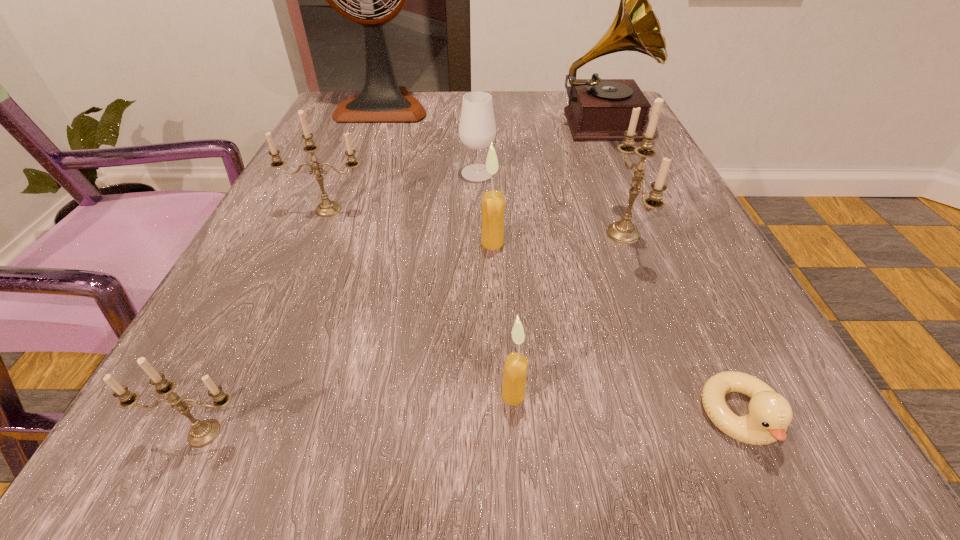
Identify the location of free space between the phonograph record and the nearer cream candle. Image resolution: width=960 pixels, height=540 pixels. (557, 260).

I want to click on object that ranks as the second closest to the shortest object, so click(x=515, y=367).

Identify the location of object that can be found as the fifth closest to the bigger cream candle. This screenshot has height=540, width=960. (599, 109).

Where is `candle that is the second closest to the nearest candle`? This screenshot has height=540, width=960. candle that is the second closest to the nearest candle is located at coordinates (327, 208).

Locate which candle is the second closest to the nearest metallic candle. Please provide its 2D coordinates. Your answer should be formatted as a tuple, i.e. [(x, y)], where the tuple contains the x and y coordinates of a point satisfying the conditions above.

[(327, 208)]

Where is `metallic candle that can be found as the second closest to the nearest candle`? The height and width of the screenshot is (540, 960). metallic candle that can be found as the second closest to the nearest candle is located at coordinates (623, 231).

Locate which metallic candle ranks in proximity to the duckling. Please provide its 2D coordinates. Your answer should be formatted as a tuple, i.e. [(x, y)], where the tuple contains the x and y coordinates of a point satisfying the conditions above.

[(623, 231)]